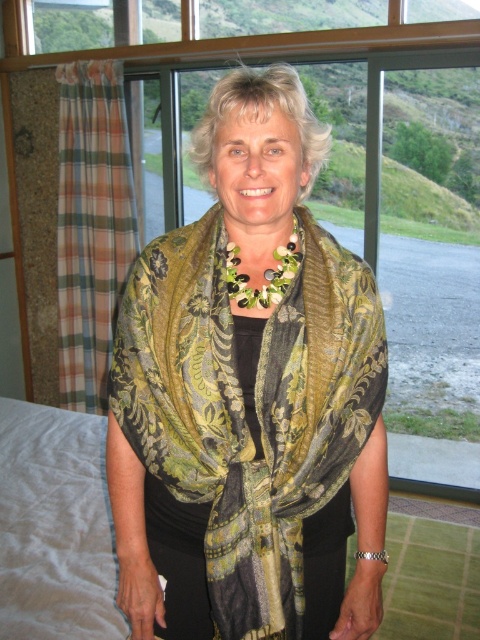
Question: Which of the following is the farthest from the observer?

Choices:
 (A) green floral silk scarf at center
 (B) green floral fabric at center

Answer: (B)

Question: Which of the following is the farthest from the observer?

Choices:
 (A) green floral silk scarf at center
 (B) green floral fabric at center

Answer: (B)

Question: Is green floral silk scarf at center thinner than green floral fabric at center?

Choices:
 (A) yes
 (B) no

Answer: (B)

Question: Considering the relative positions of green floral silk scarf at center and green floral fabric at center in the image provided, where is green floral silk scarf at center located with respect to green floral fabric at center?

Choices:
 (A) below
 (B) above

Answer: (A)

Question: Does green floral silk scarf at center appear on the left side of green floral fabric at center?

Choices:
 (A) yes
 (B) no

Answer: (A)